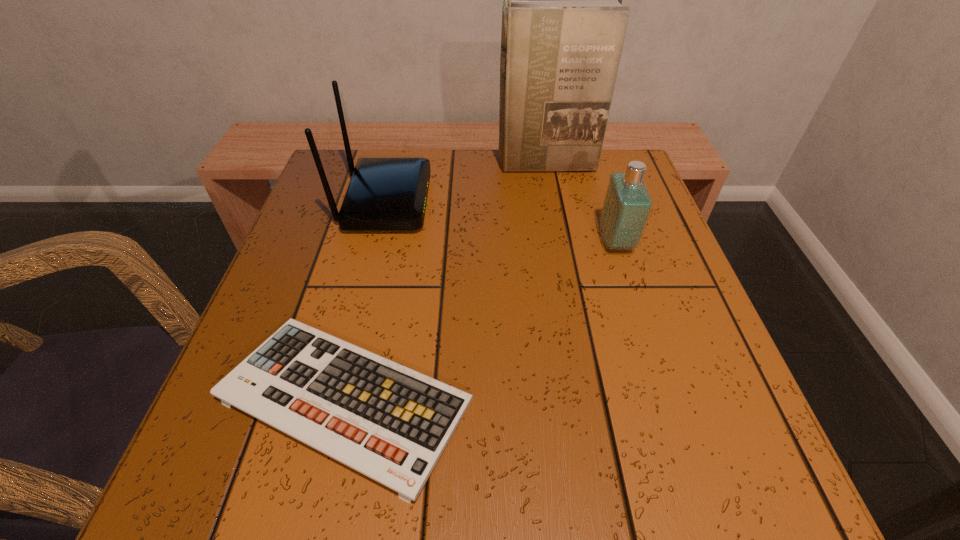
At what (x,y) coordinates should I click in order to perform the action: click on vacant space located on the back of the computer keyboard. Please return your answer as a coordinate pair (x, y). Looking at the image, I should click on (370, 295).

This screenshot has height=540, width=960. Find the location of `phonebook located at the far edge`. phonebook located at the far edge is located at coordinates (563, 26).

The image size is (960, 540). What are the coordinates of `router that is at the far edge` in the screenshot? It's located at (385, 193).

Identify the location of object at the near edge. This screenshot has height=540, width=960. (391, 423).

This screenshot has width=960, height=540. I want to click on router at the left edge, so pos(385,193).

The image size is (960, 540). Identify the location of computer keyboard that is at the left edge. (391, 423).

Where is `phonebook that is at the right edge`? phonebook that is at the right edge is located at coordinates (563, 26).

At what (x,y) coordinates should I click in order to perform the action: click on perfume positioned at the right edge. Please return your answer as a coordinate pair (x, y). The image size is (960, 540). Looking at the image, I should click on [x=627, y=204].

Identify the location of object present at the far left corner. This screenshot has width=960, height=540. (385, 193).

Where is `object that is at the near left corner`? object that is at the near left corner is located at coordinates [x=391, y=423].